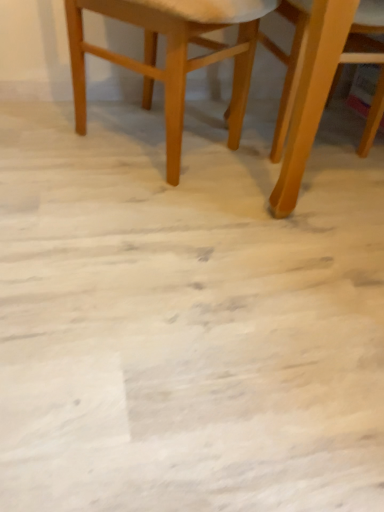
Measure the distance between point (249, 79) and camera.

4.87 feet.

The height and width of the screenshot is (512, 384). In order to click on wooden chair at center, which ranks as the first chair in left-to-right order in this screenshot , I will do `click(172, 55)`.

What is the approximate width of wooden chair at center, positioned as the 2th chair in right-to-left order?

It is 22.43 inches.

Measure the distance between wooden chair at center, positioned as the 2th chair in right-to-left order, and camera.

wooden chair at center, positioned as the 2th chair in right-to-left order, is 34.75 inches away from camera.

Describe the element at coordinates (172, 55) in the screenshot. Image resolution: width=384 pixels, height=512 pixels. I see `wooden chair at center, which ranks as the first chair in left-to-right order` at that location.

The width and height of the screenshot is (384, 512). I want to click on light brown wooden chair at upper right, the 2th chair when ordered from left to right, so click(x=289, y=65).

Describe the element at coordinates (289, 65) in the screenshot. I see `light brown wooden chair at upper right, the 2th chair when ordered from left to right` at that location.

In order to face light brown wooden chair at upper right, the 2th chair when ordered from left to right, should I rotate leftwards or rightwards?

A 21.367 degree turn to the right will do.

This screenshot has height=512, width=384. What are the coordinates of `wooden chair at center, positioned as the 2th chair in right-to-left order` in the screenshot? It's located at (172, 55).

Considering the relative positions of wooden chair at center, which ranks as the first chair in left-to-right order, and light brown wooden chair at upper right, arranged as the 1th chair when viewed from the right, in the image provided, is wooden chair at center, which ranks as the first chair in left-to-right order, to the right of light brown wooden chair at upper right, arranged as the 1th chair when viewed from the right, from the viewer's perspective?

In fact, wooden chair at center, which ranks as the first chair in left-to-right order, is to the left of light brown wooden chair at upper right, arranged as the 1th chair when viewed from the right.

Looking at this image, relative to light brown wooden chair at upper right, arranged as the 1th chair when viewed from the right, is wooden chair at center, positioned as the 2th chair in right-to-left order, in front or behind?

wooden chair at center, positioned as the 2th chair in right-to-left order, is behind light brown wooden chair at upper right, arranged as the 1th chair when viewed from the right.

Does point (242, 98) come farther from viewer compared to point (268, 45)?

Yes, point (242, 98) is farther from viewer.

From the image's perspective, is wooden chair at center, positioned as the 2th chair in right-to-left order, over light brown wooden chair at upper right, the 2th chair when ordered from left to right?

Yes.

From a real-world perspective, is wooden chair at center, positioned as the 2th chair in right-to-left order, located higher than light brown wooden chair at upper right, the 2th chair when ordered from left to right?

No, from a real-world perspective, wooden chair at center, positioned as the 2th chair in right-to-left order, is not above light brown wooden chair at upper right, the 2th chair when ordered from left to right.

Does wooden chair at center, which ranks as the first chair in left-to-right order, have a greater width compared to light brown wooden chair at upper right, the 2th chair when ordered from left to right?

No.

Can you confirm if wooden chair at center, which ranks as the first chair in left-to-right order, is shorter than light brown wooden chair at upper right, the 2th chair when ordered from left to right?

Yes.

Does wooden chair at center, positioned as the 2th chair in right-to-left order, have a smaller size compared to light brown wooden chair at upper right, the 2th chair when ordered from left to right?

Correct, wooden chair at center, positioned as the 2th chair in right-to-left order, occupies less space than light brown wooden chair at upper right, the 2th chair when ordered from left to right.

Is wooden chair at center, positioned as the 2th chair in right-to-left order, spatially inside light brown wooden chair at upper right, arranged as the 1th chair when viewed from the right, or outside of it?

The correct answer is: outside.

Is wooden chair at center, which ranks as the first chair in left-to-right order, positioned far away from light brown wooden chair at upper right, arranged as the 1th chair when viewed from the right?

No, there isn't a large distance between wooden chair at center, which ranks as the first chair in left-to-right order, and light brown wooden chair at upper right, arranged as the 1th chair when viewed from the right.

Is wooden chair at center, which ranks as the first chair in left-to-right order, aimed at light brown wooden chair at upper right, arranged as the 1th chair when viewed from the right?

Yes, wooden chair at center, which ranks as the first chair in left-to-right order, is aimed at light brown wooden chair at upper right, arranged as the 1th chair when viewed from the right.

Can you tell me how much wooden chair at center, which ranks as the first chair in left-to-right order, and light brown wooden chair at upper right, the 2th chair when ordered from left to right, differ in facing direction?

The angle between the facing direction of wooden chair at center, which ranks as the first chair in left-to-right order, and the facing direction of light brown wooden chair at upper right, the 2th chair when ordered from left to right, is 42.3 degrees.

Locate an element on the screen. chair in front of the wooden chair at center, positioned as the 2th chair in right-to-left order is located at coordinates (289, 65).

Based on their positions, is light brown wooden chair at upper right, arranged as the 1th chair when viewed from the right, located to the left or right of wooden chair at center, positioned as the 2th chair in right-to-left order?

Clearly, light brown wooden chair at upper right, arranged as the 1th chair when viewed from the right, is on the right of wooden chair at center, positioned as the 2th chair in right-to-left order, in the image.

Which object is further away from the camera, light brown wooden chair at upper right, the 2th chair when ordered from left to right, or wooden chair at center, which ranks as the first chair in left-to-right order?

wooden chair at center, which ranks as the first chair in left-to-right order, is further from the camera.

Is point (292, 100) in front of point (179, 71)?

No, it is not.

From the image's perspective, which object appears higher, light brown wooden chair at upper right, the 2th chair when ordered from left to right, or wooden chair at center, which ranks as the first chair in left-to-right order?

wooden chair at center, which ranks as the first chair in left-to-right order.

Based on the photo, from a real-world perspective, between light brown wooden chair at upper right, the 2th chair when ordered from left to right, and wooden chair at center, which ranks as the first chair in left-to-right order, who is vertically lower?

wooden chair at center, which ranks as the first chair in left-to-right order.

Looking at their sizes, would you say light brown wooden chair at upper right, arranged as the 1th chair when viewed from the right, is wider or thinner than wooden chair at center, which ranks as the first chair in left-to-right order?

In the image, light brown wooden chair at upper right, arranged as the 1th chair when viewed from the right, appears to be wider than wooden chair at center, which ranks as the first chair in left-to-right order.

Between light brown wooden chair at upper right, the 2th chair when ordered from left to right, and wooden chair at center, which ranks as the first chair in left-to-right order, which one has less height?

Standing shorter between the two is wooden chair at center, which ranks as the first chair in left-to-right order.

Which of these two, light brown wooden chair at upper right, the 2th chair when ordered from left to right, or wooden chair at center, positioned as the 2th chair in right-to-left order, is bigger?

Bigger between the two is light brown wooden chair at upper right, the 2th chair when ordered from left to right.

Is light brown wooden chair at upper right, arranged as the 1th chair when viewed from the right, positioned beyond the bounds of wooden chair at center, positioned as the 2th chair in right-to-left order?

Indeed, light brown wooden chair at upper right, arranged as the 1th chair when viewed from the right, is completely outside wooden chair at center, positioned as the 2th chair in right-to-left order.

Are light brown wooden chair at upper right, the 2th chair when ordered from left to right, and wooden chair at center, positioned as the 2th chair in right-to-left order, making contact?

light brown wooden chair at upper right, the 2th chair when ordered from left to right, is not next to wooden chair at center, positioned as the 2th chair in right-to-left order, and they're not touching.

Could you tell me if light brown wooden chair at upper right, the 2th chair when ordered from left to right, is facing wooden chair at center, positioned as the 2th chair in right-to-left order?

No, light brown wooden chair at upper right, the 2th chair when ordered from left to right, is not turned towards wooden chair at center, positioned as the 2th chair in right-to-left order.

What's the angular difference between light brown wooden chair at upper right, the 2th chair when ordered from left to right, and wooden chair at center, positioned as the 2th chair in right-to-left order,'s facing directions?

42.3 degrees separate the facing orientations of light brown wooden chair at upper right, the 2th chair when ordered from left to right, and wooden chair at center, positioned as the 2th chair in right-to-left order.

Could you measure the distance between light brown wooden chair at upper right, the 2th chair when ordered from left to right, and wooden chair at center, which ranks as the first chair in left-to-right order?

A distance of 27.44 centimeters exists between light brown wooden chair at upper right, the 2th chair when ordered from left to right, and wooden chair at center, which ranks as the first chair in left-to-right order.

Identify the location of chair positioned vertically above the wooden chair at center, positioned as the 2th chair in right-to-left order (from a real-world perspective). This screenshot has width=384, height=512. (289, 65).

Locate an element on the screen. Image resolution: width=384 pixels, height=512 pixels. chair above the light brown wooden chair at upper right, arranged as the 1th chair when viewed from the right (from the image's perspective) is located at coordinates (172, 55).

Where is `chair behind the light brown wooden chair at upper right, arranged as the 1th chair when viewed from the right`? The width and height of the screenshot is (384, 512). chair behind the light brown wooden chair at upper right, arranged as the 1th chair when viewed from the right is located at coordinates (172, 55).